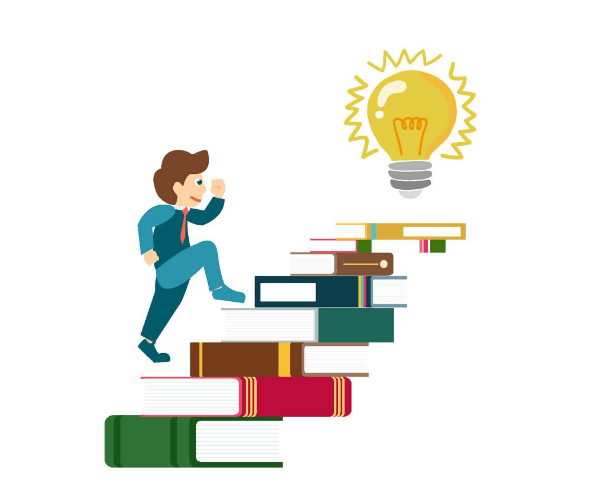
The image size is (610, 491). Find the location of `book`. book is located at coordinates (145, 424), (177, 389), (227, 351), (267, 318), (289, 284), (318, 252), (357, 238), (399, 233).